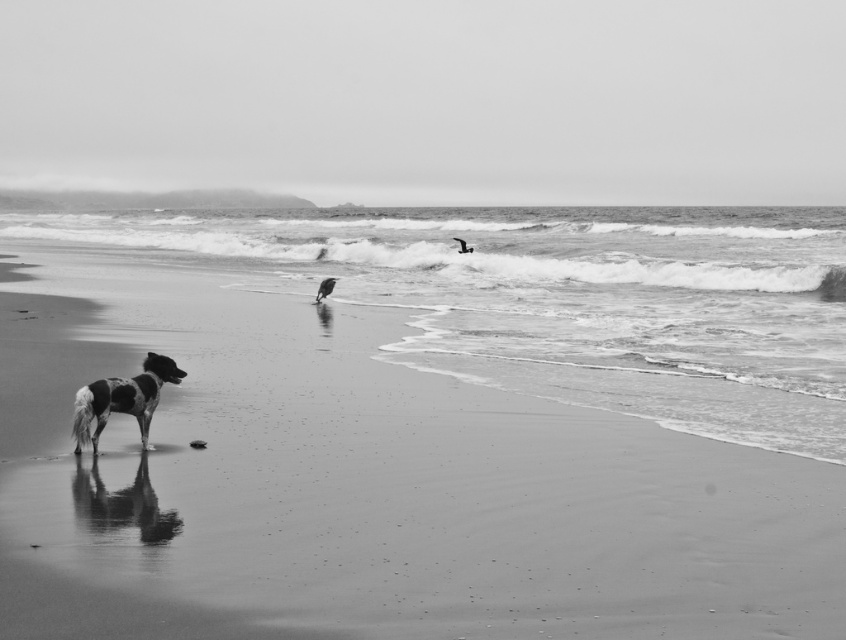
Does point (152, 412) lie in front of point (325, 284)?

Yes, it is.

Can you confirm if spotted fur dog at lower left is positioned to the left of smooth feathered bird at center?

In fact, spotted fur dog at lower left is to the right of smooth feathered bird at center.

Who is more distant from viewer, (92, 416) or (325, 292)?

The point (325, 292) is behind.

Locate an element on the screen. The width and height of the screenshot is (846, 640). spotted fur dog at lower left is located at coordinates (122, 400).

In the scene shown: Does smooth feathered bird at center lie in front of smooth feather at upper center?

Yes, smooth feathered bird at center is in front of smooth feather at upper center.

Is smooth feathered bird at center to the left of smooth feather at upper center from the viewer's perspective?

Yes, smooth feathered bird at center is to the left of smooth feather at upper center.

Which is in front, point (317, 288) or point (459, 250)?

Point (317, 288)

Identify the location of smooth feathered bird at center. Image resolution: width=846 pixels, height=640 pixels. (323, 289).

Is point (157, 385) closer to camera compared to point (467, 252)?

Yes, it is in front of point (467, 252).

Does point (114, 385) come farther from viewer compared to point (465, 244)?

No.

The width and height of the screenshot is (846, 640). I want to click on spotted fur dog at lower left, so click(x=122, y=400).